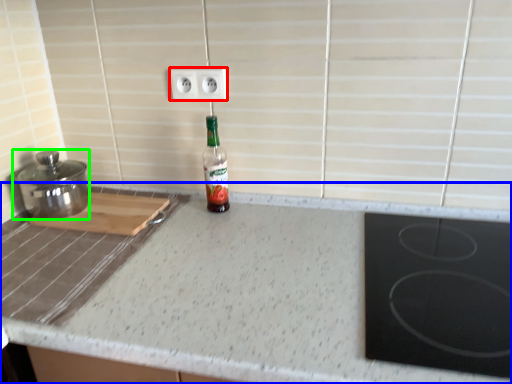
Question: Which is farther away from electric outlet (highlighted by a red box)? countertop (highlighted by a blue box) or kitchen appliance (highlighted by a green box)?

Choices:
 (A) countertop
 (B) kitchen appliance

Answer: (A)